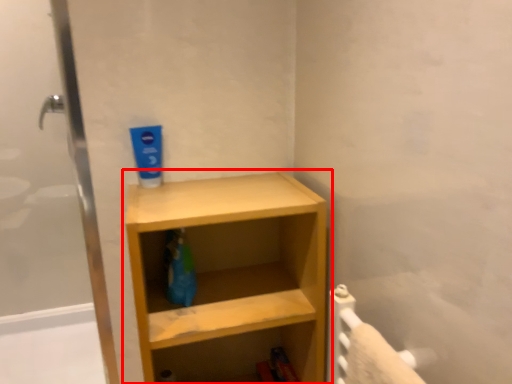
Question: From the image, what is the correct spatial relationship of shelf (annotated by the red box) in relation to toothpaste?

Choices:
 (A) right
 (B) left

Answer: (A)